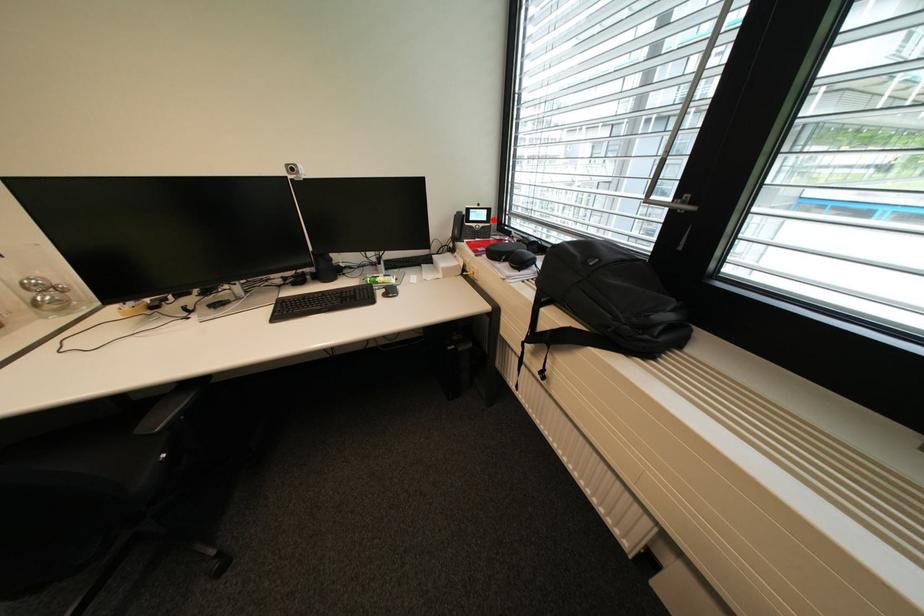
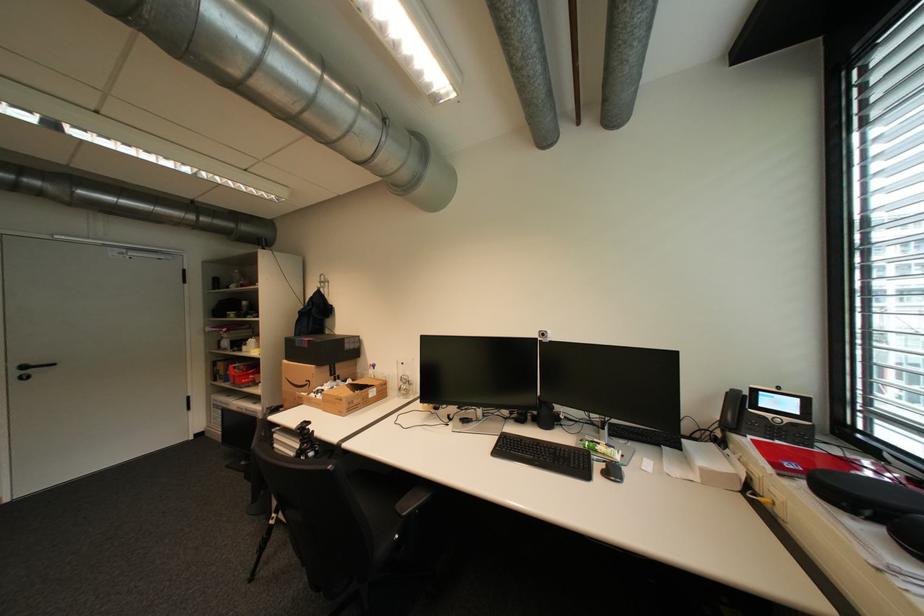
Locate, in the second image, the point that corresponds to the highlighted location in the first image.

(806, 413)